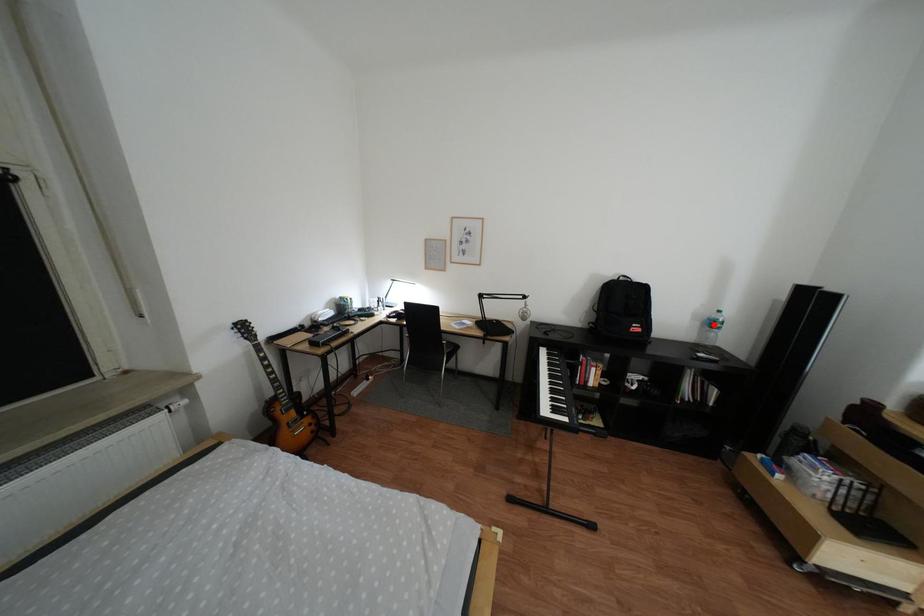
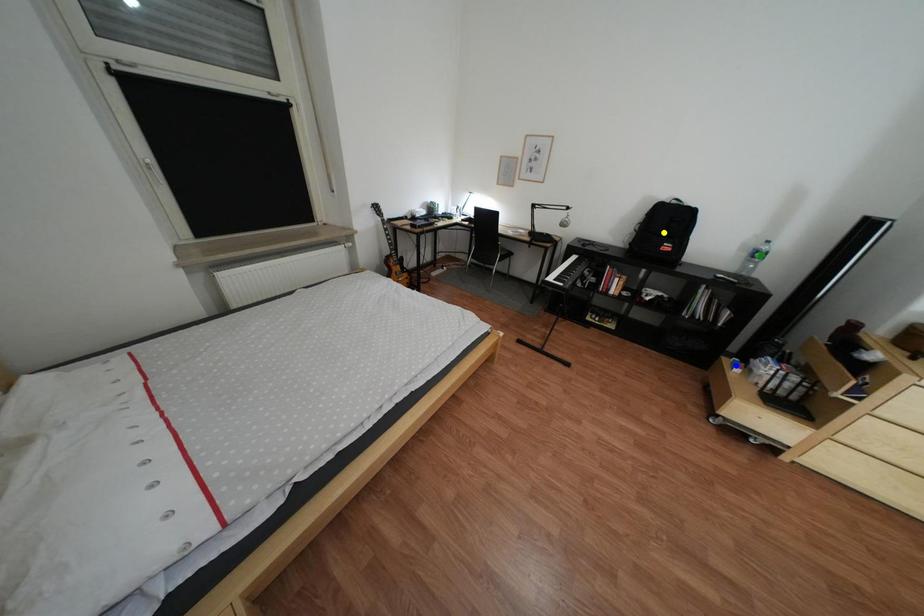
Question: I am providing you with two images of the same scene from different viewpoints. A red point is marked on the first image. You are given multiple points on the second image. Which point in image 2 represents the same 3d spot as the red point in image 1?

Choices:
 (A) blue point
 (B) green point
 (C) yellow point

Answer: (B)